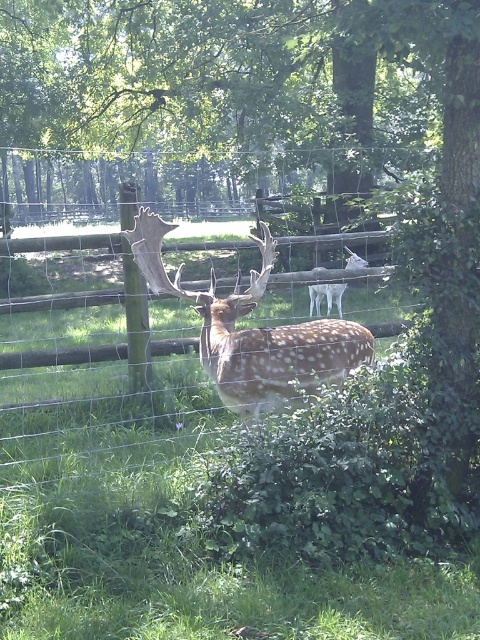
Does point (170, 435) come behind point (217, 365)?

Yes, it is.

Is wire mesh fence at center to the right of fawn-patterned antlered deer at center from the viewer's perspective?

Incorrect, wire mesh fence at center is not on the right side of fawn-patterned antlered deer at center.

Is point (149, 432) closer to viewer compared to point (219, 298)?

No.

Where is `wire mesh fence at center`? The height and width of the screenshot is (640, 480). wire mesh fence at center is located at coordinates (165, 362).

Is point (216, 348) more distant than point (312, 310)?

No, it is not.

Is point (147, 237) behind point (355, 268)?

No.

Where is `fawn-patterned antlered deer at center`? This screenshot has height=640, width=480. fawn-patterned antlered deer at center is located at coordinates (252, 332).

Who is more distant from viewer, (67, 342) or (368, 262)?

Point (368, 262)

Find the location of `wire mesh fence at center`. wire mesh fence at center is located at coordinates (165, 362).

The image size is (480, 640). In order to click on wire mesh fence at center in this screenshot , I will do `click(165, 362)`.